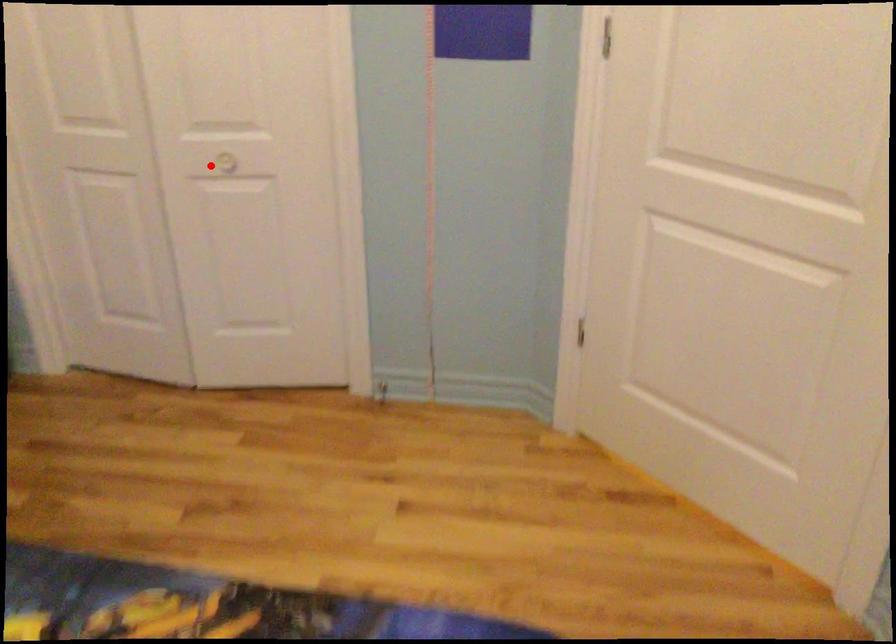
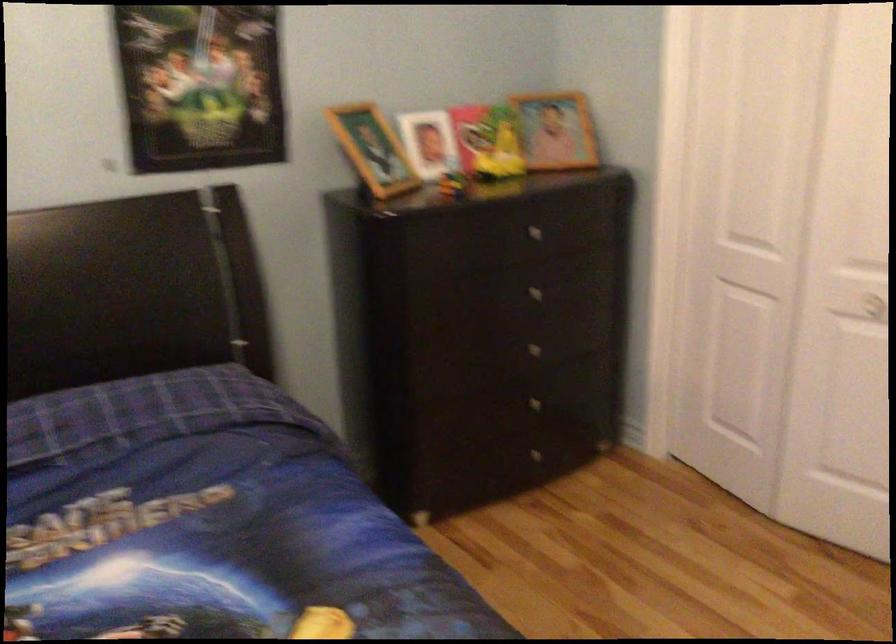
Find the pixel in the second image that matches the highlighted location in the first image.

(864, 305)